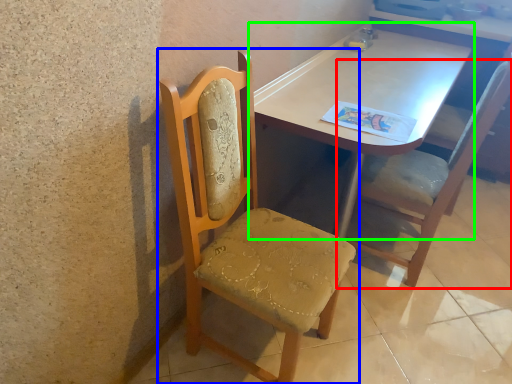
Question: Which is farther away from chair (highlighted by a red box)? chair (highlighted by a blue box) or table (highlighted by a green box)?

Choices:
 (A) chair
 (B) table

Answer: (A)